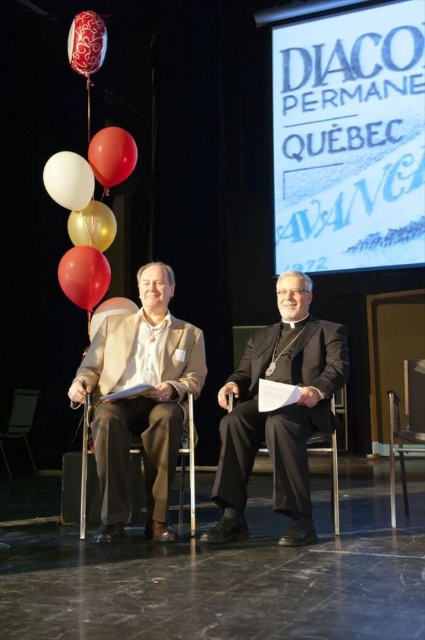
Question: Does white matte balloon at upper left appear under wooden chair at lower left?

Choices:
 (A) yes
 (B) no

Answer: (B)

Question: Which point appears farthest from the camera in this image?

Choices:
 (A) pos(76,176)
 (B) pos(95,332)
 (C) pos(8,436)
 (D) pos(410,404)

Answer: (C)

Question: Is white matte balloon at upper left positioned in front of gold metallic balloon at center?

Choices:
 (A) no
 (B) yes

Answer: (B)

Question: Can you confirm if rubber balloon at upper center is smaller than red glossy balloon at upper left?

Choices:
 (A) no
 (B) yes

Answer: (A)

Question: Which point is closer to the camera?

Choices:
 (A) black satin business suit at center
 (B) gold metallic balloon at center
 (C) matte gold balloon at center

Answer: (A)

Question: Which point is farther from the camera taking this photo?

Choices:
 (A) (130, 305)
 (B) (110, 211)

Answer: (B)